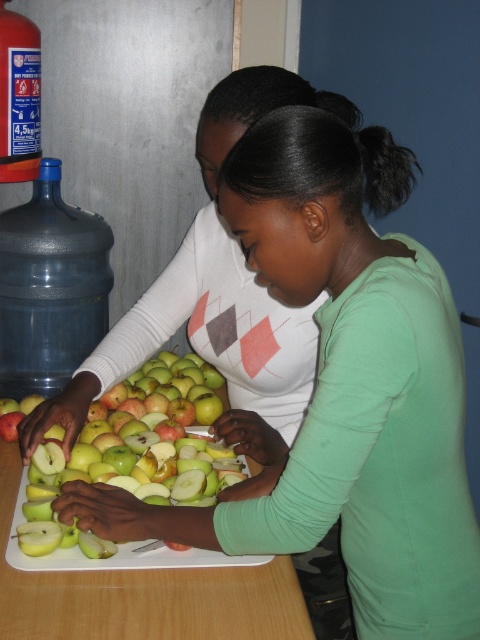
Question: Which object is farther from the camera taking this photo?

Choices:
 (A) black plastic bottle at left
 (B) blue plastic bottle at left
 (C) green matte apple at center
 (D) green plastic tray at center

Answer: (A)

Question: Can you confirm if black plastic bottle at left is bigger than blue plastic bottle at left?

Choices:
 (A) yes
 (B) no

Answer: (A)

Question: Can you confirm if black plastic bottle at left is thinner than green matte apple at center?

Choices:
 (A) no
 (B) yes

Answer: (B)

Question: Does green plastic tray at center appear over blue plastic bottle at left?

Choices:
 (A) yes
 (B) no

Answer: (B)

Question: Which object is farther from the camera taking this photo?

Choices:
 (A) blue plastic bottle at left
 (B) black plastic bottle at left
 (C) green plastic tray at center
 (D) green matte apple at center

Answer: (B)

Question: Which point appears farthest from the camera in this image?

Choices:
 (A) (156, 390)
 (B) (31, 81)

Answer: (A)